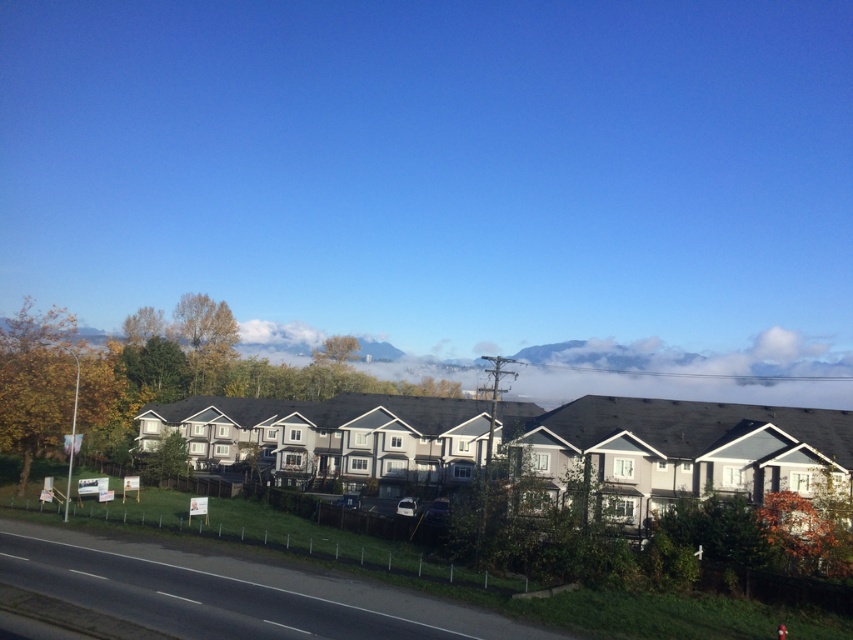
You are standing in front of the row of townhouses and looking towards the black asphalt road at lower left and the green grass at lower left. Which one is nearer to you?

The black asphalt road at lower left is closer to the viewer than the green grass at lower left, so the black asphalt road at lower left is nearer.

You are standing at the road in the foreground of the image and want to walk to the first house. There are two points marked on the grassy area in front of the houses, point A at point (260,592) and point B at point (354,536). Which point should you walk towards to reach the house faster?

Point A at point (260,592) is closer to the camera than point B at point (354,536), so walking towards point A would be faster since it is nearer to your starting position at the road.